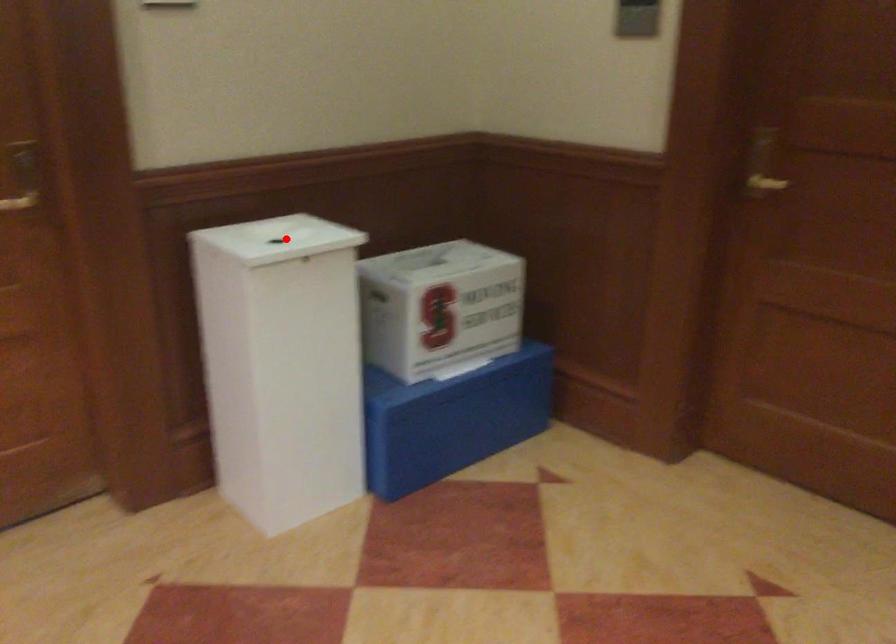
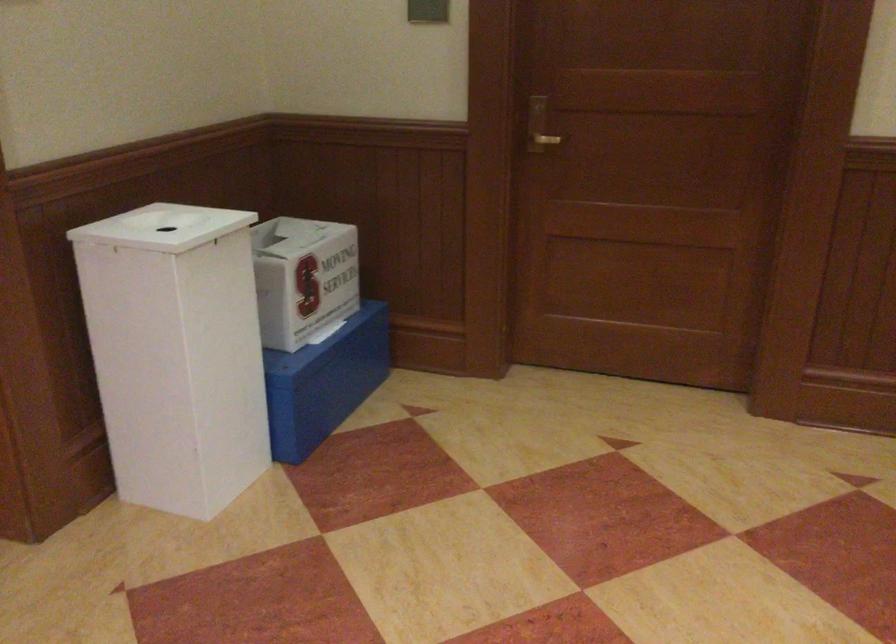
Where in the second image is the point corresponding to the highlighted location from the first image?

(164, 227)